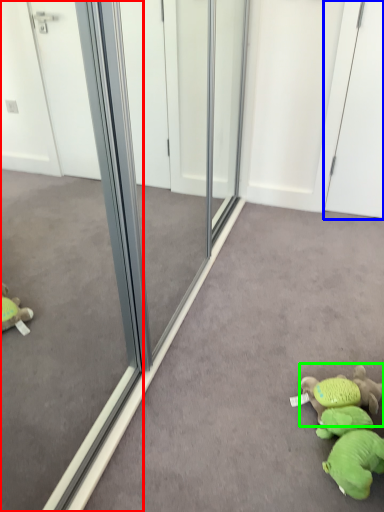
Question: Considering the real-world distances, which object is closest to glass door (highlighted by a red box)? screen door (highlighted by a blue box) or toy (highlighted by a green box).

Choices:
 (A) screen door
 (B) toy

Answer: (B)